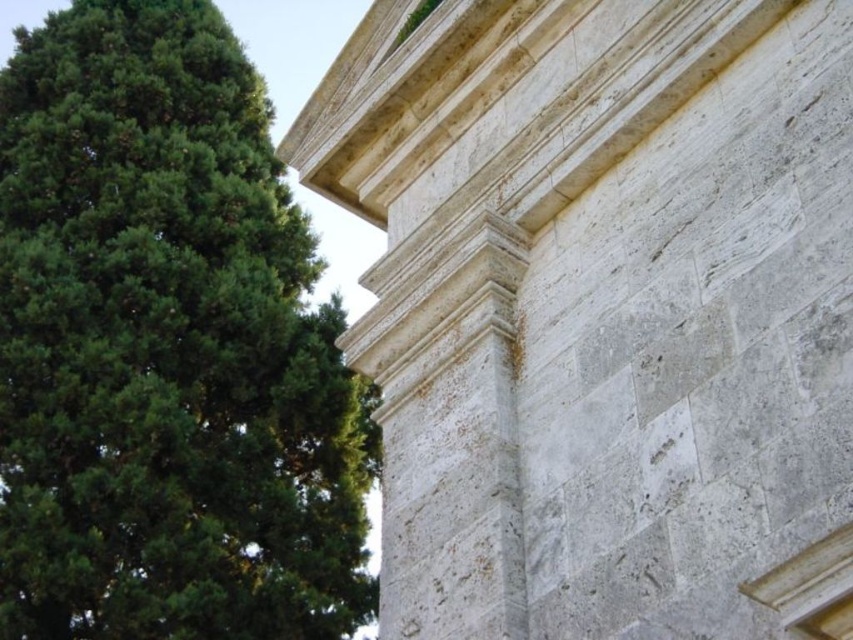
You are an architect analyzing the stone structure in the image. You notice two points marked on the stone surface at coordinates point (759, 156) and point (105, 364). Which point is nearer to your viewpoint?

Point (759, 156) is closer to the viewer than point (105, 364).

You are standing in front of a historical stone structure with lush greenery around it. You see a point at coordinates (602,310). What does this point represent?

The point at coordinates (602,310) corresponds to the white stone tower at upper right.

From the picture: You are an architect assessing the structural integrity of the white stone tower at upper right and the green leafy tree at upper left. Which object has a smaller width?

The white stone tower at upper right has a smaller width than the green leafy tree at upper left.